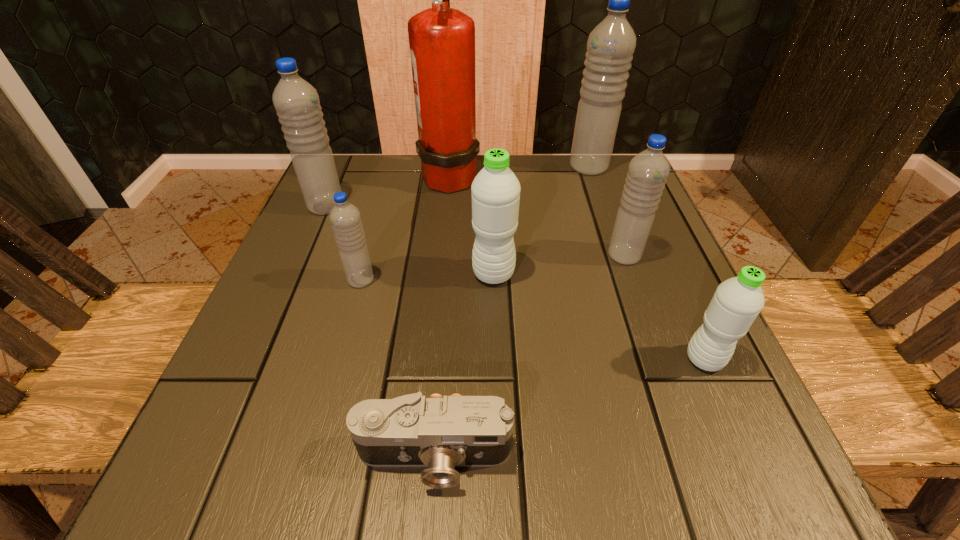
This screenshot has height=540, width=960. In the image, there is a desktop. Find the location of `free space at the near left corner`. free space at the near left corner is located at coordinates (212, 493).

At what (x,y) coordinates should I click in order to perform the action: click on vacant space at the near right corner of the desktop. Please return your answer as a coordinate pair (x, y). The image size is (960, 540). Looking at the image, I should click on (765, 465).

The width and height of the screenshot is (960, 540). In order to click on free spot between the second farthest blue water bottle and the shortest object in this screenshot , I will do `click(380, 332)`.

In order to click on free area in between the red fire extinguisher and the nearest water bottle in this screenshot , I will do `click(577, 267)`.

At what (x,y) coordinates should I click in order to perform the action: click on free point between the second farthest water bottle and the tallest object. Please return your answer as a coordinate pair (x, y). Image resolution: width=960 pixels, height=540 pixels. Looking at the image, I should click on (388, 191).

Where is `free space between the farther green water bottle and the leftmost object`? free space between the farther green water bottle and the leftmost object is located at coordinates (410, 240).

Locate an element on the screen. This screenshot has width=960, height=540. empty location between the red fire extinguisher and the second water bottle from left to right is located at coordinates (405, 227).

Where is `free space that is in between the camera and the seventh object from right to left`? The height and width of the screenshot is (540, 960). free space that is in between the camera and the seventh object from right to left is located at coordinates (397, 368).

Where is `vacant area between the smaller green water bottle and the nearest blue water bottle`? The image size is (960, 540). vacant area between the smaller green water bottle and the nearest blue water bottle is located at coordinates (533, 320).

I want to click on free area in between the nearer green water bottle and the bigger green water bottle, so click(x=599, y=316).